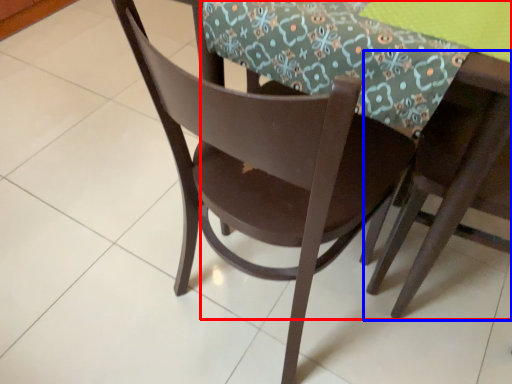
Question: Which object appears closest to the camera in this image, round table (highlighted by a red box) or chair (highlighted by a blue box)?

Choices:
 (A) round table
 (B) chair

Answer: (B)